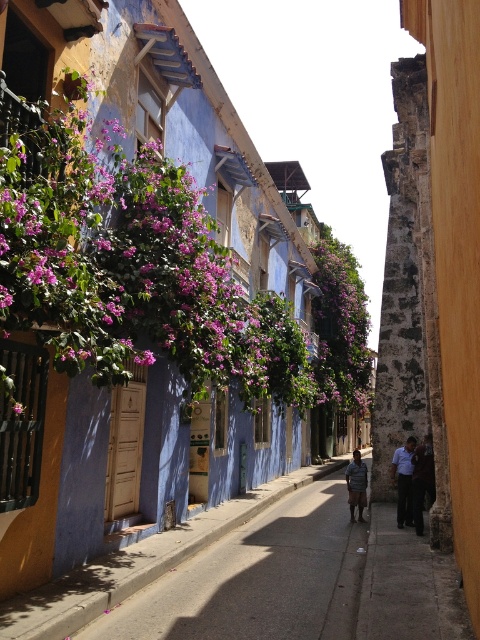
Question: Does purple leafy plant at upper left lie in front of dark blue shirt at center?

Choices:
 (A) yes
 (B) no

Answer: (A)

Question: Is smooth concrete pavement at center positioned behind dark blue shirt at center?

Choices:
 (A) yes
 (B) no

Answer: (B)

Question: Which object is the closest to the blue shirt at center?

Choices:
 (A) striped fabric shirt at center
 (B) dark blue shirt at center
 (C) purple leafy plant at upper left

Answer: (B)

Question: Which point is farther from the camera taking this photo?

Choices:
 (A) (202, 580)
 (B) (350, 506)
 (C) (392, 481)

Answer: (C)

Question: Considering the relative positions of dark blue shirt at center and blue shirt at center in the image provided, where is dark blue shirt at center located with respect to blue shirt at center?

Choices:
 (A) above
 (B) below

Answer: (A)

Question: Which point is closer to the camera?

Choices:
 (A) dark blue shirt at center
 (B) purple leafy plant at upper left
 (C) blue shirt at center
 (D) smooth concrete pavement at center

Answer: (B)